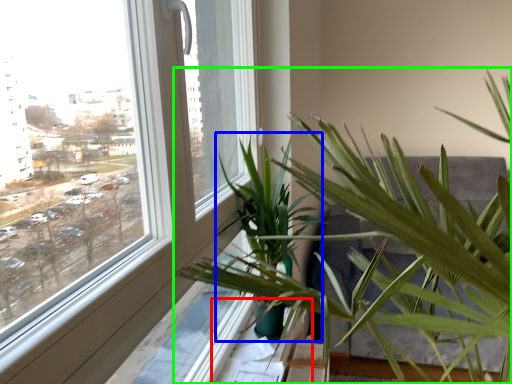
Question: Estimate the real-world distances between objects in this image. Which object is farther from window sill (highlighted by a red box), palm tree (highlighted by a blue box) or houseplant (highlighted by a green box)?

Choices:
 (A) palm tree
 (B) houseplant

Answer: (B)